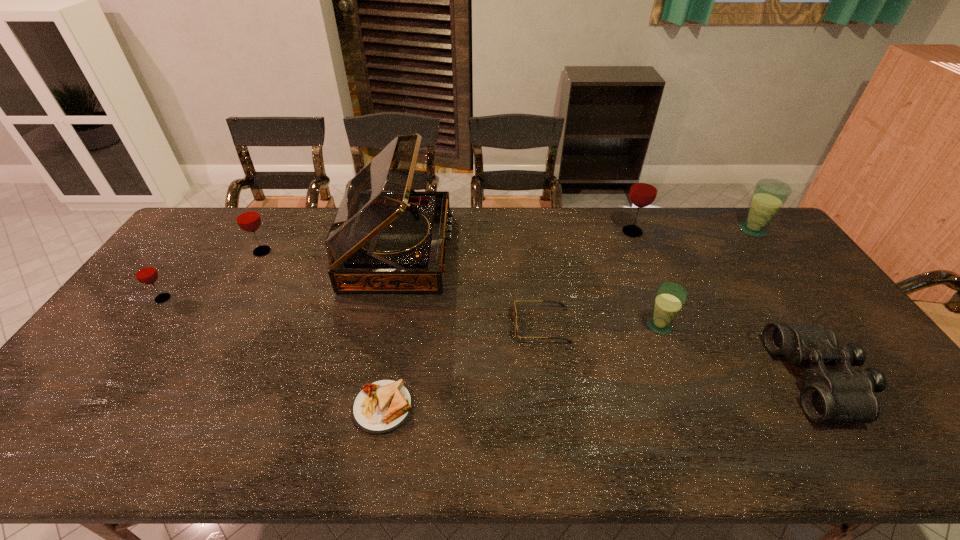
Find the location of a particular element. vacant space at the left edge is located at coordinates (113, 350).

Identify the location of free space that is in between the sunglasses and the beige sandwich. The image size is (960, 540). (463, 366).

Locate an element on the screen. The width and height of the screenshot is (960, 540). empty location between the record player and the sandwich is located at coordinates (391, 329).

Where is `empty space that is in between the farther blue glass and the third shortest object`? The width and height of the screenshot is (960, 540). empty space that is in between the farther blue glass and the third shortest object is located at coordinates (785, 305).

You are a GUI agent. You are given a task and a screenshot of the screen. Output one action in this format:
    pyautogui.click(x=<x>, y=<y>)
    Task: Click on the unoccupied position between the nearer blue glass and the second smallest red glass
    This screenshot has width=960, height=540.
    Given the screenshot: What is the action you would take?
    pyautogui.click(x=461, y=288)

Locate an element on the screen. The width and height of the screenshot is (960, 540). vacant area that lies between the fourth farthest glass and the sunglasses is located at coordinates (352, 312).

You are a GUI agent. You are given a task and a screenshot of the screen. Output one action in this format:
    pyautogui.click(x=<x>, y=<y>)
    Task: Click on the free space between the nearest glass and the second object from left to right
    
    Given the screenshot: What is the action you would take?
    pyautogui.click(x=461, y=288)

In order to click on vacant area between the beige sandwich and the rightmost red glass in this screenshot , I will do `click(508, 320)`.

This screenshot has width=960, height=540. Identify the location of object that stands as the fifth closest to the fifth object from left to right. (843, 395).

Find the location of a particular element. the third closest object to the nearer blue glass is located at coordinates (644, 189).